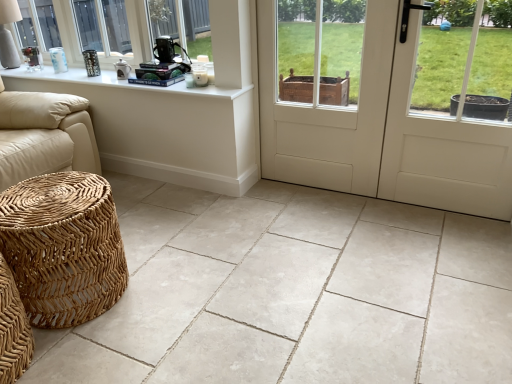
Question: Is white ceramic table lamp at upper left oriented away from woven rattan stool at lower left?

Choices:
 (A) no
 (B) yes

Answer: (A)

Question: Considering the relative sizes of white ceramic table lamp at upper left and woven rattan stool at lower left in the image provided, is white ceramic table lamp at upper left taller than woven rattan stool at lower left?

Choices:
 (A) yes
 (B) no

Answer: (B)

Question: Can you confirm if white ceramic table lamp at upper left is shorter than woven rattan stool at lower left?

Choices:
 (A) yes
 (B) no

Answer: (A)

Question: Is the surface of white ceramic table lamp at upper left in direct contact with woven rattan stool at lower left?

Choices:
 (A) yes
 (B) no

Answer: (B)

Question: Is white ceramic table lamp at upper left not within woven rattan stool at lower left?

Choices:
 (A) no
 (B) yes

Answer: (B)

Question: Are white ceramic table lamp at upper left and woven rattan stool at lower left far apart?

Choices:
 (A) yes
 (B) no

Answer: (A)

Question: Considering the relative sizes of natural stone tile at lower left and woven rattan stool at lower left in the image provided, is natural stone tile at lower left thinner than woven rattan stool at lower left?

Choices:
 (A) yes
 (B) no

Answer: (B)

Question: Is natural stone tile at lower left at the left side of woven rattan stool at lower left?

Choices:
 (A) yes
 (B) no

Answer: (B)

Question: Considering the relative sizes of natural stone tile at lower left and woven rattan stool at lower left in the image provided, is natural stone tile at lower left smaller than woven rattan stool at lower left?

Choices:
 (A) yes
 (B) no

Answer: (B)

Question: From a real-world perspective, does natural stone tile at lower left sit lower than woven rattan stool at lower left?

Choices:
 (A) yes
 (B) no

Answer: (A)

Question: Considering the relative sizes of natural stone tile at lower left and woven rattan stool at lower left in the image provided, is natural stone tile at lower left bigger than woven rattan stool at lower left?

Choices:
 (A) yes
 (B) no

Answer: (A)

Question: Does natural stone tile at lower left have a greater width compared to woven rattan stool at lower left?

Choices:
 (A) no
 (B) yes

Answer: (B)

Question: Is white wood screen door at center smaller than white matte door at center?

Choices:
 (A) yes
 (B) no

Answer: (A)